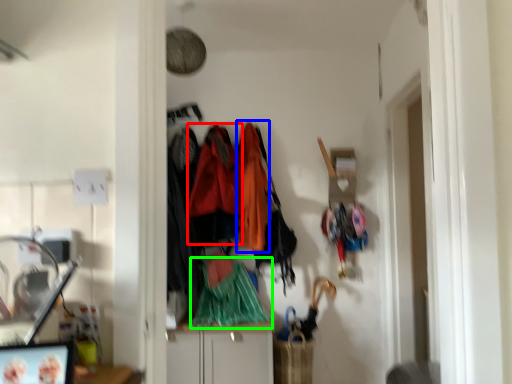
Question: Which is farther away from clothing (highlighted by a red box)? clothing (highlighted by a blue box) or clothing (highlighted by a green box)?

Choices:
 (A) clothing
 (B) clothing

Answer: (B)